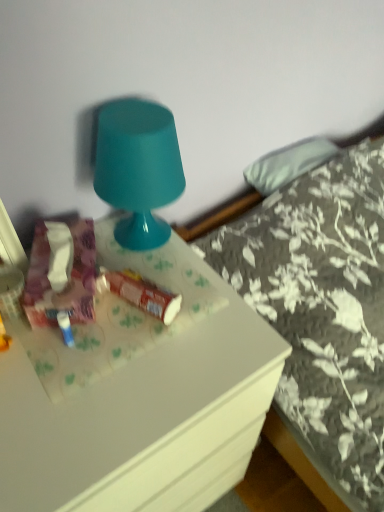
What do you see at coordinates (318, 311) in the screenshot?
I see `floral fabric bed at upper right` at bounding box center [318, 311].

The height and width of the screenshot is (512, 384). Describe the element at coordinates (137, 395) in the screenshot. I see `white glossy desk at center` at that location.

The height and width of the screenshot is (512, 384). What are the coordinates of `matte plastic tube at center, arranged as the first stuff when viewed from the right` in the screenshot? It's located at pos(139,293).

This screenshot has width=384, height=512. What are the coordinates of `floral fabric bed at upper right` in the screenshot? It's located at (318, 311).

From the image's perspective, who appears lower, floral fabric bed at upper right or matte floral tissue box at left, the second stuff from the right?

floral fabric bed at upper right, from the image's perspective.

Between point (344, 433) and point (77, 250), which one is positioned in front?

The point (77, 250) is closer to the camera.

Locate an element on the screen. The image size is (384, 512). bed lying in front of the matte floral tissue box at left, which appears as the 1th stuff when viewed from the left is located at coordinates (318, 311).

Considering the relative sizes of floral fabric bed at upper right and matte floral tissue box at left, the second stuff from the right, in the image provided, is floral fabric bed at upper right bigger than matte floral tissue box at left, the second stuff from the right,?

Indeed, floral fabric bed at upper right has a larger size compared to matte floral tissue box at left, the second stuff from the right.

Is matte floral tissue box at left, which appears as the 1th stuff when viewed from the left, facing towards floral fabric bed at upper right?

No, matte floral tissue box at left, which appears as the 1th stuff when viewed from the left, does not turn towards floral fabric bed at upper right.

Considering the sizes of objects matte floral tissue box at left, the second stuff from the right, and floral fabric bed at upper right in the image provided, who is taller, matte floral tissue box at left, the second stuff from the right, or floral fabric bed at upper right?

Standing taller between the two is floral fabric bed at upper right.

Is point (53, 256) in front of point (290, 396)?

Yes, point (53, 256) is closer to viewer.

Is matte floral tissue box at left, the second stuff from the right, in front of or behind floral fabric bed at upper right in the image?

matte floral tissue box at left, the second stuff from the right, is positioned farther from the viewer than floral fabric bed at upper right.

From a real-world perspective, between white glossy desk at center and glossy plastic lamp at upper center, who is vertically lower?

In real-world perspective, white glossy desk at center is lower.

Are white glossy desk at center and glossy plastic lamp at upper center far apart?

white glossy desk at center is actually quite close to glossy plastic lamp at upper center.

This screenshot has width=384, height=512. In order to click on lamp that is on the right side of white glossy desk at center in this screenshot , I will do `click(138, 168)`.

Does matte plastic tube at center, the second stuff when ordered from left to right, come in front of matte floral tissue box at left, which appears as the 1th stuff when viewed from the left?

No, matte plastic tube at center, the second stuff when ordered from left to right, is behind matte floral tissue box at left, which appears as the 1th stuff when viewed from the left.

Considering the relative sizes of matte plastic tube at center, arranged as the first stuff when viewed from the right, and matte floral tissue box at left, the second stuff from the right, in the image provided, is matte plastic tube at center, arranged as the first stuff when viewed from the right, taller than matte floral tissue box at left, the second stuff from the right,?

No.

Can you tell me how much matte plastic tube at center, arranged as the first stuff when viewed from the right, and matte floral tissue box at left, which appears as the 1th stuff when viewed from the left, differ in facing direction?

The angular difference between matte plastic tube at center, arranged as the first stuff when viewed from the right, and matte floral tissue box at left, which appears as the 1th stuff when viewed from the left, is 46.1 degrees.

Considering the sizes of matte plastic tube at center, the second stuff when ordered from left to right, and matte floral tissue box at left, the second stuff from the right, in the image, is matte plastic tube at center, the second stuff when ordered from left to right, bigger or smaller than matte floral tissue box at left, the second stuff from the right,?

Considering their sizes, matte plastic tube at center, the second stuff when ordered from left to right, takes up less space than matte floral tissue box at left, the second stuff from the right.

Which stuff is the 1st one when counting from the back of the white glossy desk at center? Please provide its 2D coordinates.

[(66, 282)]

Is the surface of white glossy desk at center in direct contact with matte floral tissue box at left, which appears as the 1th stuff when viewed from the left?

white glossy desk at center and matte floral tissue box at left, which appears as the 1th stuff when viewed from the left, are not in contact.

Is point (102, 226) closer to viewer compared to point (79, 240)?

No, it is behind (79, 240).

In the scene shown: Considering the relative positions of white glossy desk at center and matte floral tissue box at left, the second stuff from the right, in the image provided, is white glossy desk at center behind matte floral tissue box at left, the second stuff from the right,?

No, it is not.

Is matte plastic tube at center, the second stuff when ordered from left to right, closer to the viewer compared to white glossy desk at center?

No.

Considering the positions of point (106, 287) and point (132, 506), is point (106, 287) closer or farther from the camera than point (132, 506)?

Clearly, point (106, 287) is more distant from the camera than point (132, 506).

Considering the relative sizes of matte plastic tube at center, arranged as the first stuff when viewed from the right, and white glossy desk at center in the image provided, is matte plastic tube at center, arranged as the first stuff when viewed from the right, thinner than white glossy desk at center?

Yes.

From the image's perspective, who appears lower, matte plastic tube at center, arranged as the first stuff when viewed from the right, or white glossy desk at center?

white glossy desk at center is shown below in the image.

Based on the photo, considering the relative positions of matte plastic tube at center, arranged as the first stuff when viewed from the right, and floral fabric bed at upper right in the image provided, is matte plastic tube at center, arranged as the first stuff when viewed from the right, behind floral fabric bed at upper right?

Yes.

From a real-world perspective, is matte plastic tube at center, the second stuff when ordered from left to right, positioned above or below floral fabric bed at upper right?

Clearly, from a real-world perspective, matte plastic tube at center, the second stuff when ordered from left to right, is above floral fabric bed at upper right.

From the image's perspective, does matte plastic tube at center, arranged as the first stuff when viewed from the right, appear lower than floral fabric bed at upper right?

Actually, matte plastic tube at center, arranged as the first stuff when viewed from the right, appears above floral fabric bed at upper right in the image.

Which is in front, point (101, 279) or point (316, 476)?

Point (101, 279)

Locate an element on the screen. This screenshot has height=512, width=384. stuff that is the 2nd object to the left of the floral fabric bed at upper right, starting at the anchor is located at coordinates (66, 282).

You are a GUI agent. You are given a task and a screenshot of the screen. Output one action in this format:
    pyautogui.click(x=<x>, y=<y>)
    Task: Click on the bed on the right of matte floral tissue box at left, which appears as the 1th stuff when viewed from the left
    The image size is (384, 512).
    Given the screenshot: What is the action you would take?
    pos(318,311)

From the image, which object appears to be farther from floral fabric bed at upper right, glossy plastic lamp at upper center or matte plastic tube at center, arranged as the first stuff when viewed from the right?

matte plastic tube at center, arranged as the first stuff when viewed from the right.

Considering their positions, is white glossy desk at center positioned further to matte plastic tube at center, arranged as the first stuff when viewed from the right, than floral fabric bed at upper right?

floral fabric bed at upper right.

Based on their spatial positions, is floral fabric bed at upper right or matte plastic tube at center, arranged as the first stuff when viewed from the right, further from glossy plastic lamp at upper center?

The object further to glossy plastic lamp at upper center is floral fabric bed at upper right.

From the picture: Considering their positions, is matte plastic tube at center, arranged as the first stuff when viewed from the right, positioned further to glossy plastic lamp at upper center than white glossy desk at center?

Based on the image, white glossy desk at center appears to be further to glossy plastic lamp at upper center.

From the image, which object appears to be farther from white glossy desk at center, matte plastic tube at center, arranged as the first stuff when viewed from the right, or floral fabric bed at upper right?

Among the two, floral fabric bed at upper right is located further to white glossy desk at center.

From the image, which object appears to be farther from glossy plastic lamp at upper center, matte floral tissue box at left, which appears as the 1th stuff when viewed from the left, or floral fabric bed at upper right?

floral fabric bed at upper right is positioned further to the anchor glossy plastic lamp at upper center.

When comparing their distances from glossy plastic lamp at upper center, does white glossy desk at center or matte plastic tube at center, the second stuff when ordered from left to right, seem further?

Among the two, white glossy desk at center is located further to glossy plastic lamp at upper center.

Looking at the image, which one is located closer to matte floral tissue box at left, which appears as the 1th stuff when viewed from the left, glossy plastic lamp at upper center or matte plastic tube at center, the second stuff when ordered from left to right?

matte plastic tube at center, the second stuff when ordered from left to right, lies closer to matte floral tissue box at left, which appears as the 1th stuff when viewed from the left, than the other object.

At what (x,y) coordinates should I click in order to perform the action: click on stuff situated between matte floral tissue box at left, the second stuff from the right, and floral fabric bed at upper right from left to right. Please return your answer as a coordinate pair (x, y). Looking at the image, I should click on (139, 293).

What are the coordinates of `stuff that lies between glossy plastic lamp at upper center and matte plastic tube at center, the second stuff when ordered from left to right, from top to bottom` in the screenshot? It's located at (66, 282).

Find the location of `desk situated between matte floral tissue box at left, the second stuff from the right, and floral fabric bed at upper right from left to right`. desk situated between matte floral tissue box at left, the second stuff from the right, and floral fabric bed at upper right from left to right is located at coordinates (137, 395).

The width and height of the screenshot is (384, 512). Find the location of `lamp situated between matte floral tissue box at left, the second stuff from the right, and floral fabric bed at upper right from left to right`. lamp situated between matte floral tissue box at left, the second stuff from the right, and floral fabric bed at upper right from left to right is located at coordinates (138, 168).